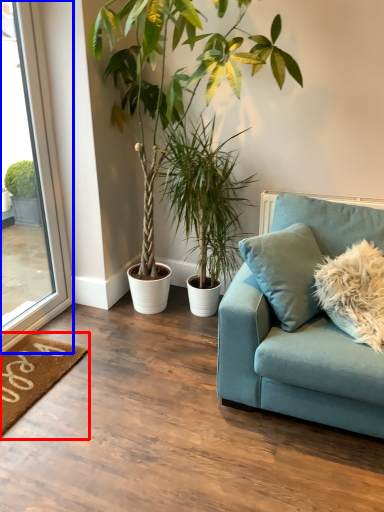
Question: Which object is further to the camera taking this photo, doormat (highlighted by a red box) or window (highlighted by a blue box)?

Choices:
 (A) doormat
 (B) window

Answer: (A)